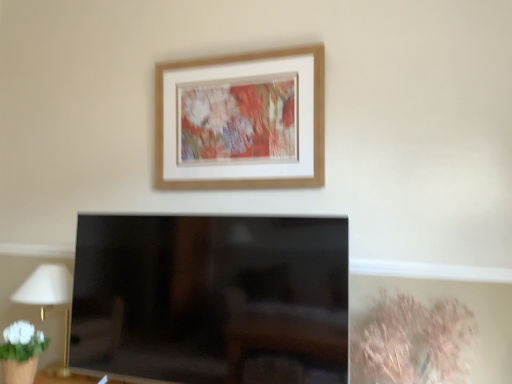
Question: Is white fabric lampshade at left at the right side of dry grass at lower right?

Choices:
 (A) yes
 (B) no

Answer: (B)

Question: Considering the relative sizes of white fabric lampshade at left and dry grass at lower right in the image provided, is white fabric lampshade at left smaller than dry grass at lower right?

Choices:
 (A) yes
 (B) no

Answer: (A)

Question: From a real-world perspective, is white fabric lampshade at left positioned under dry grass at lower right based on gravity?

Choices:
 (A) yes
 (B) no

Answer: (B)

Question: Does white fabric lampshade at left have a greater height compared to dry grass at lower right?

Choices:
 (A) yes
 (B) no

Answer: (A)

Question: Is white fabric lampshade at left in contact with dry grass at lower right?

Choices:
 (A) yes
 (B) no

Answer: (B)

Question: Could you tell me if white fabric lampshade at left is turned towards dry grass at lower right?

Choices:
 (A) no
 (B) yes

Answer: (A)

Question: Does wooden picture frame at upper center have a lesser width compared to dry grass at lower right?

Choices:
 (A) no
 (B) yes

Answer: (B)

Question: From a real-world perspective, is wooden picture frame at upper center physically above dry grass at lower right?

Choices:
 (A) no
 (B) yes

Answer: (B)

Question: From a real-world perspective, is wooden picture frame at upper center physically below dry grass at lower right?

Choices:
 (A) no
 (B) yes

Answer: (A)

Question: Does wooden picture frame at upper center have a greater height compared to dry grass at lower right?

Choices:
 (A) yes
 (B) no

Answer: (A)

Question: Can dry grass at lower right be found inside wooden picture frame at upper center?

Choices:
 (A) no
 (B) yes

Answer: (A)

Question: Is wooden picture frame at upper center wider than dry grass at lower right?

Choices:
 (A) no
 (B) yes

Answer: (A)

Question: Would you say dry grass at lower right contains wooden picture frame at upper center?

Choices:
 (A) yes
 (B) no

Answer: (B)